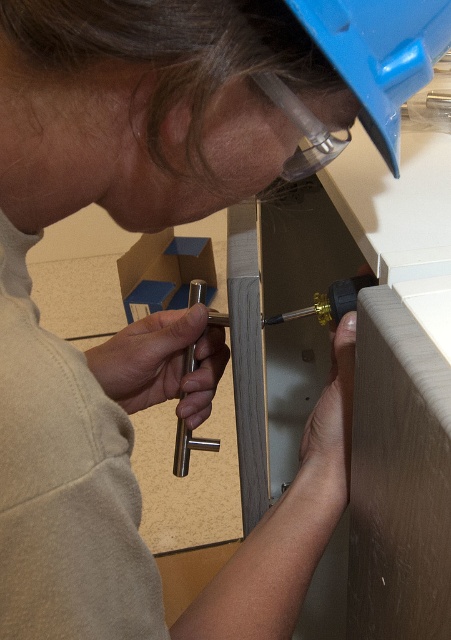
Is blue plastic helmet at upper center bigger than gold metallic screwdriver at center?

No, blue plastic helmet at upper center is not bigger than gold metallic screwdriver at center.

Between blue plastic helmet at upper center and gold metallic screwdriver at center, which one is positioned lower?

gold metallic screwdriver at center is lower down.

Describe the element at coordinates (380, 54) in the screenshot. I see `blue plastic helmet at upper center` at that location.

This screenshot has width=451, height=640. Identify the location of blue plastic helmet at upper center. (380, 54).